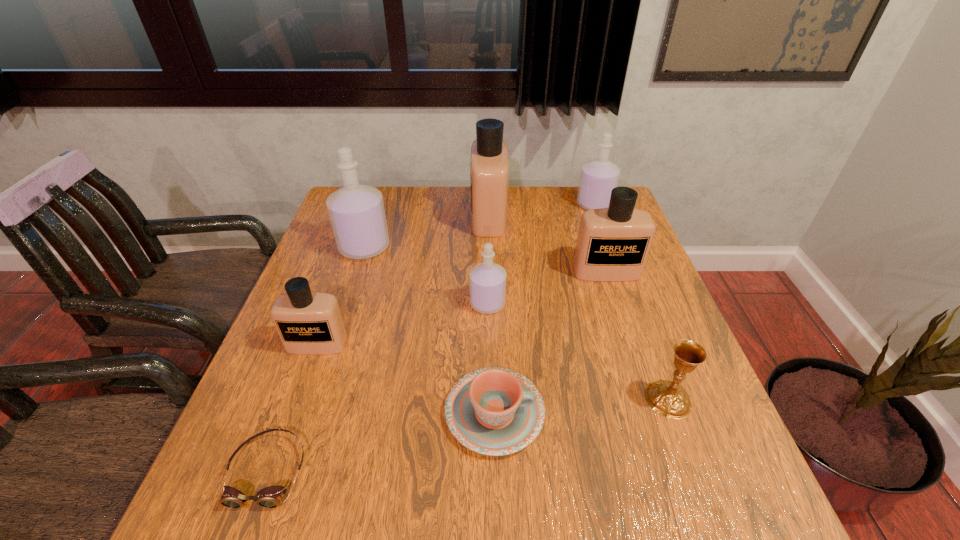
Locate an element on the screen. The image size is (960, 540). object positioned at the near left corner is located at coordinates (270, 497).

This screenshot has width=960, height=540. Identify the location of object situated at the far right corner. (598, 177).

The width and height of the screenshot is (960, 540). What are the coordinates of `vacant space at the far edge of the desktop` in the screenshot? It's located at (545, 202).

Where is `vacant space at the near edge of the desktop`? The height and width of the screenshot is (540, 960). vacant space at the near edge of the desktop is located at coordinates (489, 517).

Image resolution: width=960 pixels, height=540 pixels. In the image, there is a desktop. Find the location of `free space at the left edge`. free space at the left edge is located at coordinates (318, 399).

The height and width of the screenshot is (540, 960). In the image, there is a desktop. Identify the location of vacant space at the right edge. (658, 334).

Identify the location of free point at the near right corner. The height and width of the screenshot is (540, 960). (746, 510).

Identify the location of vacant point located between the smallest beige perfume and the farthest beige perfume. The width and height of the screenshot is (960, 540). (403, 280).

Where is `vacant space in between the rightmost beige perfume and the eighth tallest object`? vacant space in between the rightmost beige perfume and the eighth tallest object is located at coordinates (550, 342).

At what (x,y) coordinates should I click in order to perform the action: click on blank region between the gold chalice and the second smallest purple perfume. Please return your answer as a coordinate pair (x, y). Looking at the image, I should click on (632, 302).